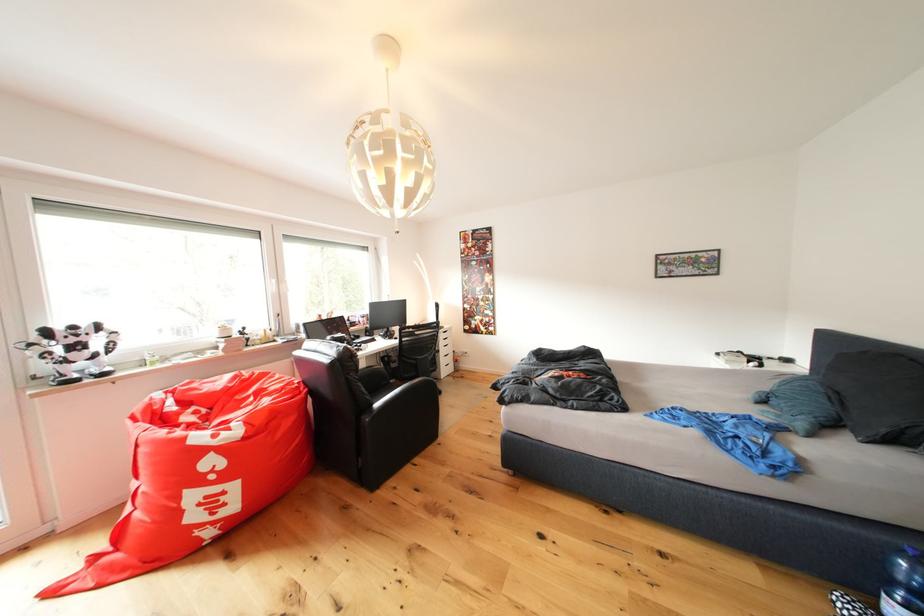
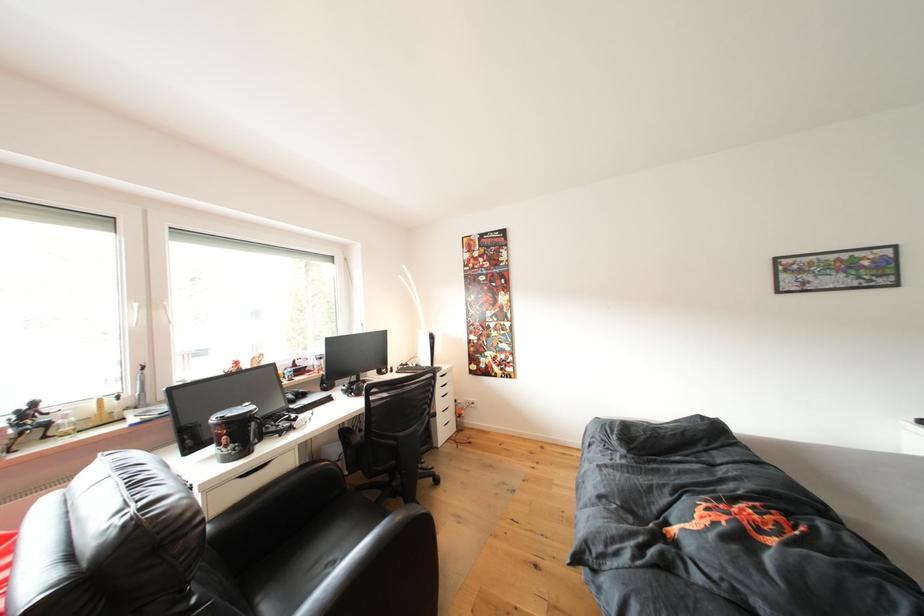
Find the pixel in the second image that matches (444,350) in the first image.

(439, 411)